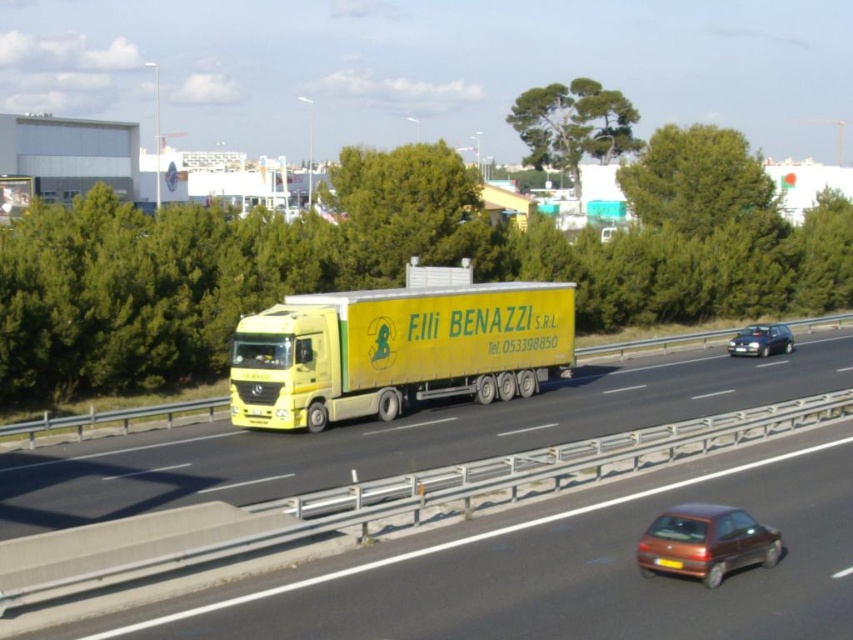
Question: In this image, where is yellow matte truck at center located relative to metallic silver sedan at right?

Choices:
 (A) above
 (B) below

Answer: (B)

Question: Estimate the real-world distances between objects in this image. Which object is farther from the yellow matte truck at center?

Choices:
 (A) yellow matte trailer truck at center
 (B) metallic brown hatchback at lower right
 (C) metallic silver sedan at right

Answer: (C)

Question: Which point is closer to the camera taking this photo?

Choices:
 (A) (747, 328)
 (B) (374, 344)
 (C) (666, 560)

Answer: (C)

Question: Considering the real-world distances, which object is closest to the yellow plastic license plate at center?

Choices:
 (A) metallic brown hatchback at lower right
 (B) yellow matte trailer truck at center
 (C) metallic silver sedan at right
 (D) yellow matte truck at center

Answer: (A)

Question: Is the position of yellow matte trailer truck at center less distant than that of metallic brown hatchback at lower right?

Choices:
 (A) yes
 (B) no

Answer: (B)

Question: Is yellow matte truck at center wider than metallic brown hatchback at lower right?

Choices:
 (A) yes
 (B) no

Answer: (A)